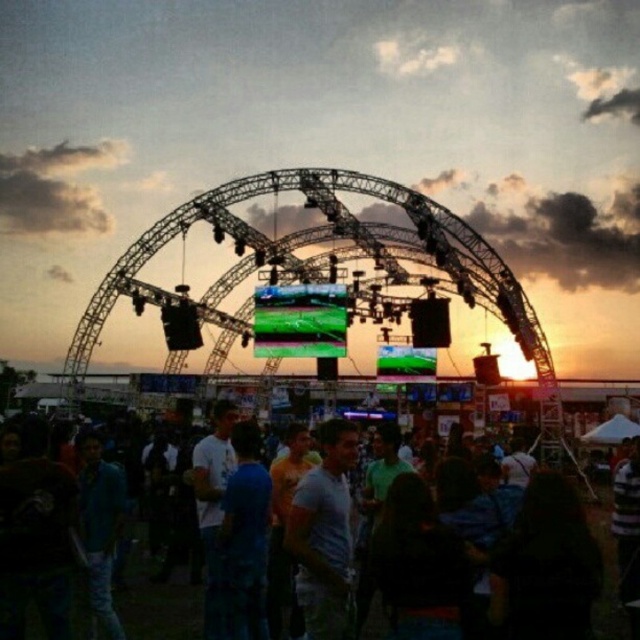
Consider the image. You are a photographer at the event and want to capture both the white cotton shirt at center and the dark blue casual shirt at center in a single frame. Which shirt should you focus on first to ensure both are in the shot?

The white cotton shirt at center is above the dark blue casual shirt at center, so focusing on the white cotton shirt at center first will ensure both shirts are captured in the frame.

You are a photographer at the event and want to capture both the white cotton shirt at center and the dark blue casual shirt at center in a single shot. Since you want both to be fully visible, which person should you position closer to the camera to avoid cropping?

The dark blue casual shirt at center should be positioned closer to the camera because it is shorter than the white cotton shirt at center, allowing both to fit within the frame without cropping.

You are a photographer at the event and want to capture both the white cotton shirt at center and the dark blue casual shirt at center in a single photo. However, you can only adjust your camera angle slightly. Which shirt should you focus on to ensure both are visible in the frame?

To ensure both the white cotton shirt at center and the dark blue casual shirt at center are visible, focus on the white cotton shirt at center since the dark blue casual shirt at center is behind it. By positioning the camera so the white cotton shirt is in the foreground, you can include the dark blue casual shirt behind it within the same frame.